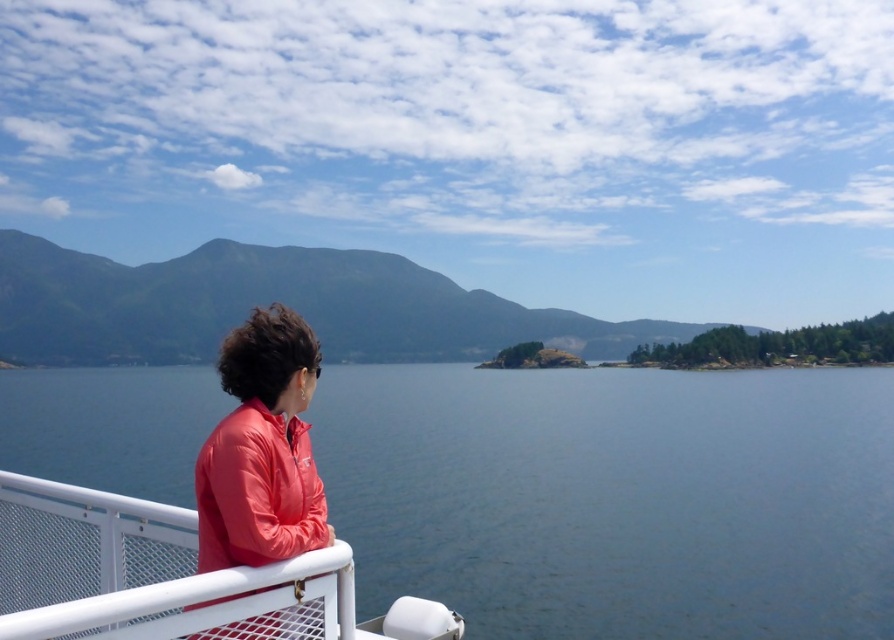
Is green matte mountain at upper left taller than matte red jacket at lower left?

Yes.

How much distance is there between green matte mountain at upper left and matte red jacket at lower left?

green matte mountain at upper left and matte red jacket at lower left are 165.46 meters apart from each other.

Which is in front, point (13, 310) or point (94, 554)?

Point (94, 554) is in front.

Locate an element on the screen. green matte mountain at upper left is located at coordinates (268, 301).

Can you confirm if green matte mountain at upper left is positioned above matte red jacket at left?

Yes.

Between point (515, 328) and point (317, 515), which one is positioned in front?

Point (317, 515)

Where is `green matte mountain at upper left`? green matte mountain at upper left is located at coordinates (268, 301).

Does blue water at center have a lesser width compared to green matte mountain at upper left?

Correct, blue water at center's width is less than green matte mountain at upper left's.

Is point (892, 609) closer to viewer compared to point (110, 272)?

Yes.

Where is `blue water at center`? blue water at center is located at coordinates (617, 497).